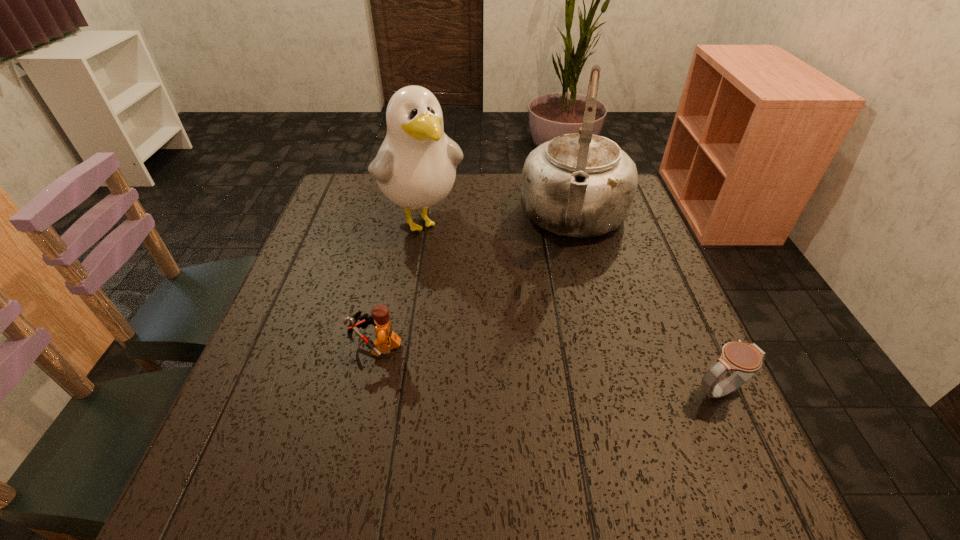
Locate an element on the screen. The height and width of the screenshot is (540, 960). Lego is located at coordinates (387, 339).

I want to click on watch, so click(x=746, y=359).

Identify the location of gull. This screenshot has height=540, width=960. (415, 167).

I want to click on kettle, so click(x=580, y=185).

Image resolution: width=960 pixels, height=540 pixels. I want to click on free location located 0.140m holding a crossbow in the hands of the Lego, so click(x=280, y=346).

I want to click on vacant region located holding a crossbow in the hands of the Lego, so click(x=266, y=346).

I want to click on vacant space situated on the left of the watch, so (x=559, y=390).

Where is `free space located 0.250m on the beak of the gull`? The image size is (960, 540). free space located 0.250m on the beak of the gull is located at coordinates (481, 313).

Locate an element on the screen. free space located on the beak of the gull is located at coordinates (515, 363).

In order to click on vacant space located on the beak of the gull in this screenshot , I will do `click(460, 281)`.